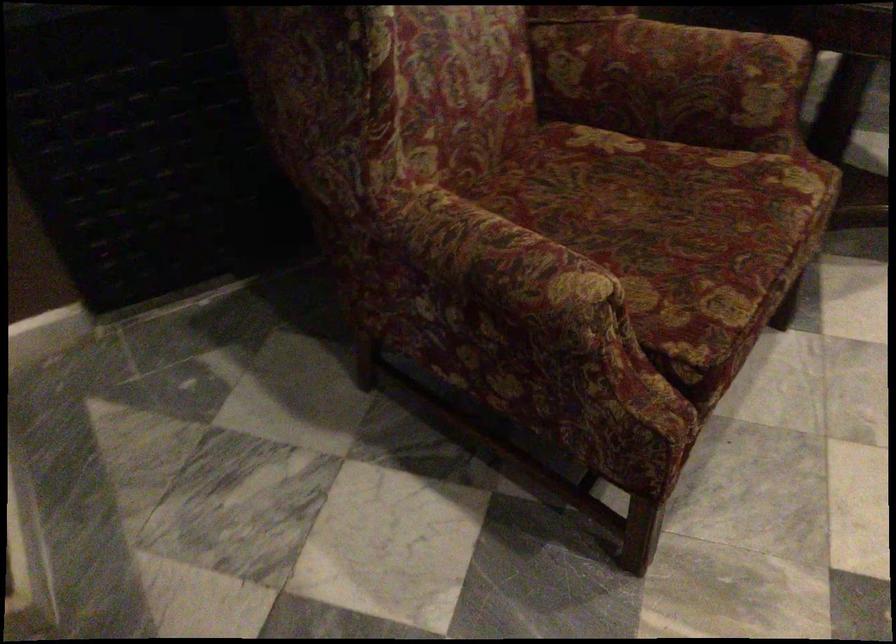
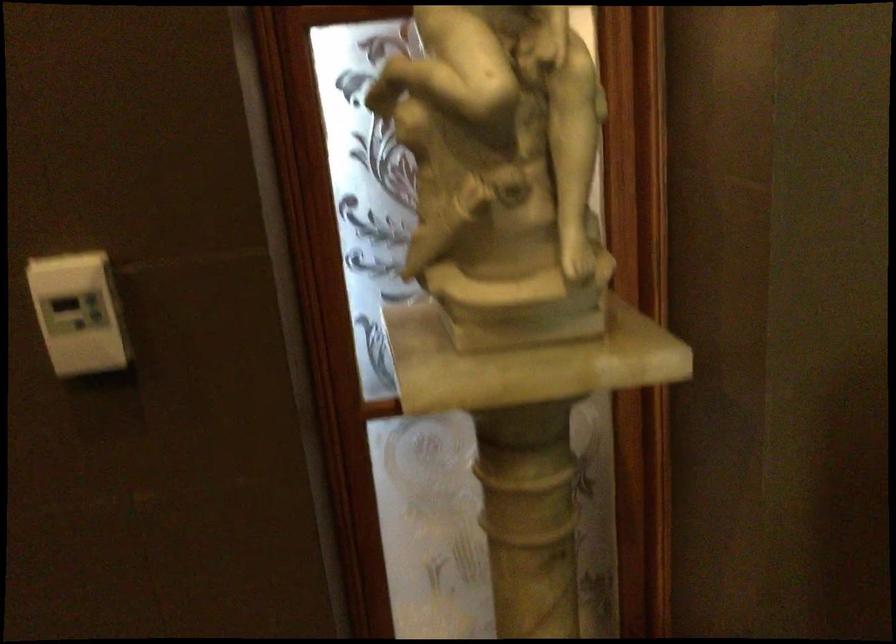
The images are taken continuously from a first-person perspective. In which direction is your viewpoint rotating?

The camera rotated toward left-down.